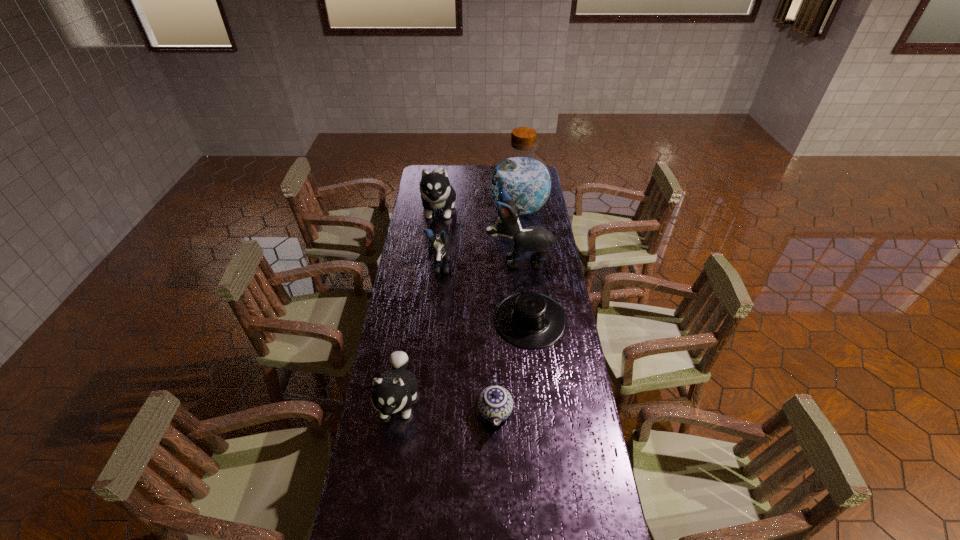
Locate an element on the screen. This screenshot has width=960, height=540. black dress hat is located at coordinates (529, 320).

Identify the location of the fifth farthest object. Image resolution: width=960 pixels, height=540 pixels. (529, 320).

In order to click on vacant space located on the left of the water jug in this screenshot , I will do `click(438, 210)`.

Find the location of `free space located 0.190m on the front-facing side of the second tallest object`. free space located 0.190m on the front-facing side of the second tallest object is located at coordinates (444, 260).

You are a GUI agent. You are given a task and a screenshot of the screen. Output one action in this format:
    pyautogui.click(x=<x>, y=<y>)
    Task: Click on the free point located on the front-facing side of the second tallest object
    The image size is (960, 540).
    Given the screenshot: What is the action you would take?
    pyautogui.click(x=442, y=260)

At what (x,y) coordinates should I click in order to perform the action: click on vacant space located 0.300m on the front-facing side of the second tallest object. Please return your answer as a coordinate pair (x, y). The height and width of the screenshot is (540, 960). Looking at the image, I should click on (420, 260).

At what (x,y) coordinates should I click in order to perform the action: click on free space located 0.070m at the face of the bigger white puppy. Please return your answer as a coordinate pair (x, y). Looking at the image, I should click on (435, 238).

Find the location of a particular element. free space located on the front-facing side of the smaller black puppy is located at coordinates (433, 333).

Locate an element on the screen. This screenshot has height=540, width=960. vacant space located at the face of the nearer white puppy is located at coordinates (381, 508).

What are the coordinates of `free space located 0.180m at the spout of the blue chinaware` in the screenshot? It's located at (497, 498).